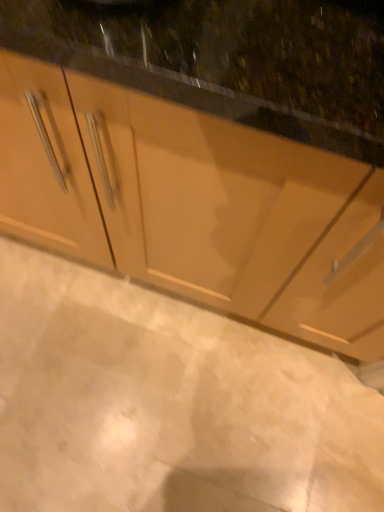
Question: From a real-world perspective, does white marble floor at lower center stand above matte wood cabinet at center?

Choices:
 (A) no
 (B) yes

Answer: (A)

Question: Is white marble floor at lower center at the right side of matte wood cabinet at center?

Choices:
 (A) no
 (B) yes

Answer: (A)

Question: Does white marble floor at lower center have a greater width compared to matte wood cabinet at center?

Choices:
 (A) yes
 (B) no

Answer: (B)

Question: Does white marble floor at lower center appear on the left side of matte wood cabinet at center?

Choices:
 (A) yes
 (B) no

Answer: (A)

Question: Considering the relative positions of white marble floor at lower center and matte wood cabinet at center in the image provided, is white marble floor at lower center behind matte wood cabinet at center?

Choices:
 (A) yes
 (B) no

Answer: (A)

Question: From the image's perspective, is white marble floor at lower center under matte wood cabinet at center?

Choices:
 (A) no
 (B) yes

Answer: (B)

Question: From the image's perspective, is matte wood cabinet at center located beneath white marble floor at lower center?

Choices:
 (A) no
 (B) yes

Answer: (A)

Question: Does matte wood cabinet at center come in front of white marble floor at lower center?

Choices:
 (A) no
 (B) yes

Answer: (B)

Question: Does matte wood cabinet at center appear on the left side of white marble floor at lower center?

Choices:
 (A) yes
 (B) no

Answer: (B)

Question: Is the position of matte wood cabinet at center more distant than that of white marble floor at lower center?

Choices:
 (A) no
 (B) yes

Answer: (A)

Question: Is matte wood cabinet at center beside white marble floor at lower center?

Choices:
 (A) yes
 (B) no

Answer: (B)

Question: Is matte wood cabinet at center taller than white marble floor at lower center?

Choices:
 (A) yes
 (B) no

Answer: (A)

Question: From a real-world perspective, is white marble floor at lower center positioned above or below matte wood cabinet at center?

Choices:
 (A) below
 (B) above

Answer: (A)